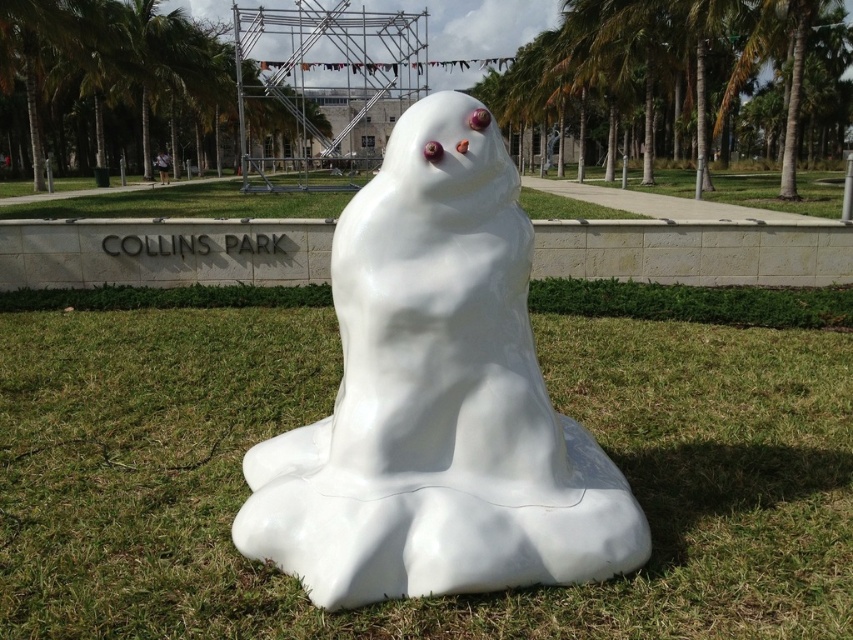
Is white grass at center thinner than white glossy ghost at center?

Yes.

Who is positioned more to the left, white grass at center or white glossy ghost at center?

Positioned to the left is white grass at center.

The height and width of the screenshot is (640, 853). What do you see at coordinates (329, 410) in the screenshot? I see `white grass at center` at bounding box center [329, 410].

Locate an element on the screen. white grass at center is located at coordinates (329, 410).